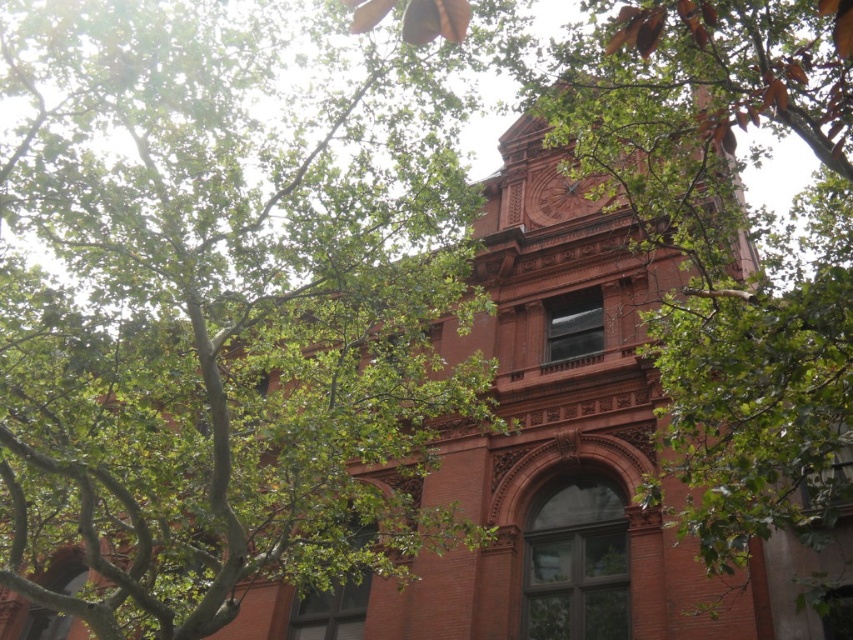
Which is below, green leafy tree at upper center or matte brown clock at upper center?

green leafy tree at upper center

Can you confirm if green leafy tree at upper center is smaller than matte brown clock at upper center?

Actually, green leafy tree at upper center might be larger than matte brown clock at upper center.

Is point (55, 115) more distant than point (567, 180)?

No, it is not.

Locate an element on the screen. green leafy tree at upper center is located at coordinates (222, 304).